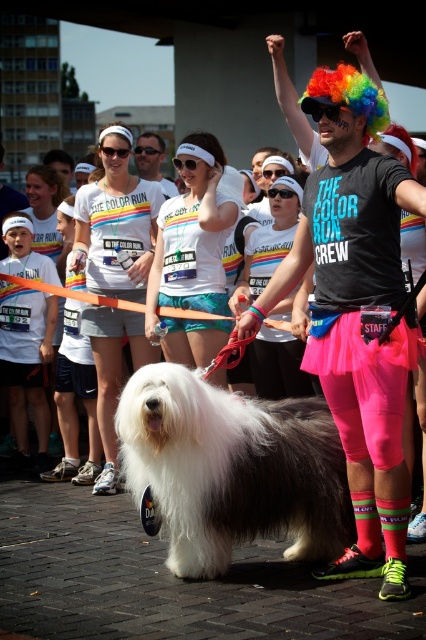
Question: Observing the image, what is the correct spatial positioning of white fluffy dog at center in reference to matte white shirt at center?

Choices:
 (A) right
 (B) left

Answer: (A)

Question: Which of the following is the farthest from the observer?

Choices:
 (A) (170, 195)
 (B) (298, 545)

Answer: (A)

Question: Is neon pink spandex at center smaller than white fluffy dog at center?

Choices:
 (A) yes
 (B) no

Answer: (B)

Question: Which object is closer to the camera taking this photo?

Choices:
 (A) neon pink spandex at center
 (B) matte white shirt at center
 (C) white fluffy dog at center

Answer: (A)

Question: Observing the image, what is the correct spatial positioning of neon pink spandex at center in reference to white fluffy dog at center?

Choices:
 (A) right
 (B) left

Answer: (A)

Question: Estimate the real-world distances between objects in this image. Which object is closer to the neon pink spandex at center?

Choices:
 (A) matte white shirt at center
 (B) white fluffy dog at center

Answer: (B)